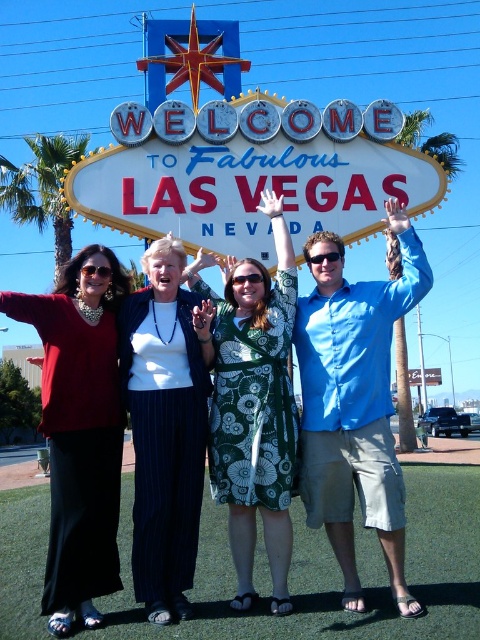
Question: Which point is closer to the camera?

Choices:
 (A) (74, 563)
 (B) (372, 353)
 (C) (288, 140)

Answer: (A)

Question: Where is matte black dress at left located in relation to green floral dress at center in the image?

Choices:
 (A) below
 (B) above

Answer: (A)

Question: Observing the image, what is the correct spatial positioning of blue cotton shirt at center in reference to green floral dress at center?

Choices:
 (A) below
 (B) above

Answer: (A)

Question: Which point appears closest to the camera in this image?

Choices:
 (A) (215, 376)
 (B) (95, 275)
 (C) (244, 189)

Answer: (A)

Question: Can you confirm if blue cotton shirt at center is positioned below white knit sweater at center?

Choices:
 (A) yes
 (B) no

Answer: (B)

Question: Which object is positioned closest to the white metallic sign at center?

Choices:
 (A) green floral dress at center
 (B) matte black dress at left

Answer: (A)